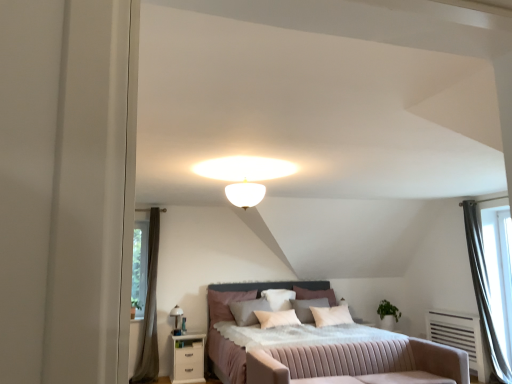
Question: In terms of width, does pink fabric swivel chair at center look wider or thinner when compared to silvery metallic curtain at right, which is the 1th curtain in right-to-left order?

Choices:
 (A) wide
 (B) thin

Answer: (A)

Question: In terms of height, does pink fabric swivel chair at center look taller or shorter compared to silvery metallic curtain at right, which is counted as the second curtain, starting from the left?

Choices:
 (A) short
 (B) tall

Answer: (A)

Question: Considering the real-world distances, which object is closest to the white glass ceiling light at center?

Choices:
 (A) pink fabric swivel chair at center
 (B) soft pink pillow at center, which is the third pillow from left to right
 (C) white soft pillow at center, which is counted as the second pillow, starting from the right
 (D) pink fabric bed at center
 (E) velvet-like pink pillow at center, which is the first pillow from left to right

Answer: (D)

Question: Estimate the real-world distances between objects in this image. Which object is closer to the soft pink pillow at center, which is the third pillow from left to right?

Choices:
 (A) silvery metallic curtain at right, which is the 1th curtain in right-to-left order
 (B) pink fabric bed at center
 (C) brown fabric curtain at left, the first curtain in the left-to-right sequence
 (D) white glass ceiling light at center
 (E) pink fabric swivel chair at center

Answer: (B)